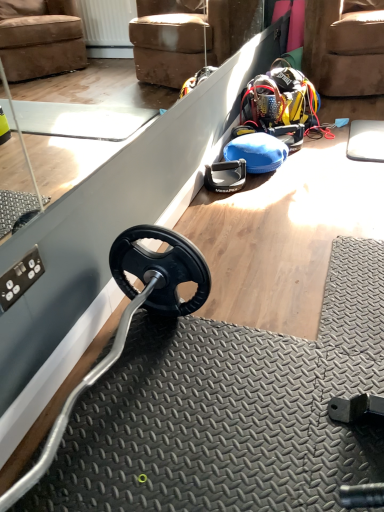
Question: From the image's perspective, is brown suede armchair at upper right located above or below black rubber weight at center?

Choices:
 (A) above
 (B) below

Answer: (A)

Question: From a real-world perspective, relative to black rubber weight at center, is brown suede armchair at upper right vertically above or below?

Choices:
 (A) below
 (B) above

Answer: (B)

Question: Does point tap(309, 73) appear closer or farther from the camera than point tap(241, 166)?

Choices:
 (A) closer
 (B) farther

Answer: (B)

Question: Is point (215, 186) positioned closer to the camera than point (316, 52)?

Choices:
 (A) farther
 (B) closer

Answer: (B)

Question: From a real-world perspective, is black rubber weight at center above or below brown suede armchair at upper right?

Choices:
 (A) above
 (B) below

Answer: (B)

Question: Considering the positions of black rubber weight at center and brown suede armchair at upper right in the image, is black rubber weight at center wider or thinner than brown suede armchair at upper right?

Choices:
 (A) thin
 (B) wide

Answer: (A)

Question: Considering their positions, is black rubber weight at center located in front of or behind brown suede armchair at upper right?

Choices:
 (A) behind
 (B) front

Answer: (B)